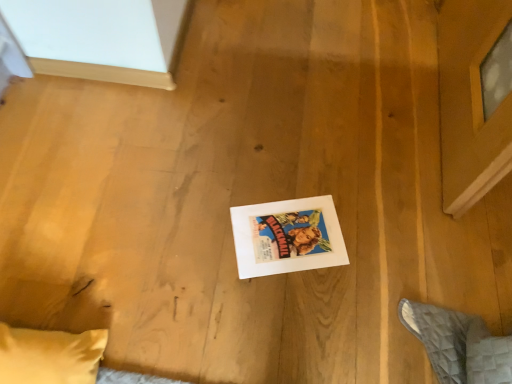
Where is `blank area to the left of white paper at center`? The height and width of the screenshot is (384, 512). blank area to the left of white paper at center is located at coordinates (201, 236).